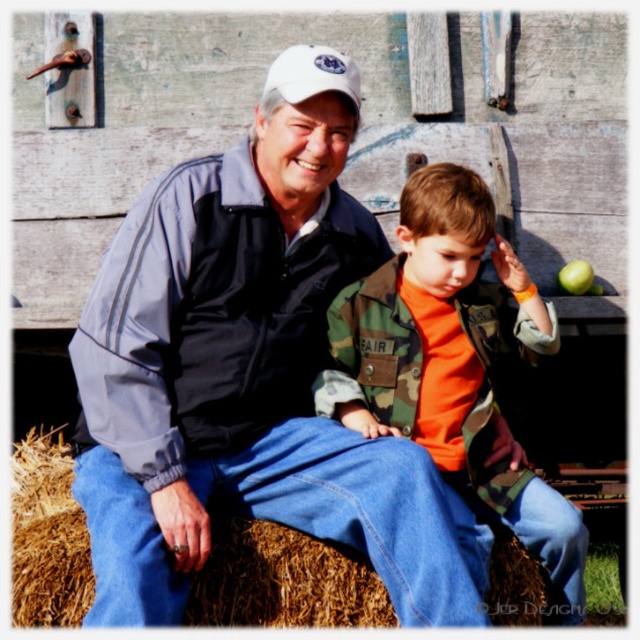
Between point (129, 304) and point (362, 300), which one is positioned in front?

Point (129, 304) is in front.

Does matte blue jacket at center appear on the left side of camouflage jacket at center?

Yes, matte blue jacket at center is to the left of camouflage jacket at center.

Between point (417, 580) and point (429, 260), which one is positioned in front?

Point (417, 580) is in front.

What are the coordinates of `matte blue jacket at center` in the screenshot? It's located at (248, 385).

Does matte blue jacket at center appear on the left side of brown straw bale at center?

In fact, matte blue jacket at center is to the right of brown straw bale at center.

Who is more forward, [179,376] or [22,477]?

Point [179,376] is more forward.

The width and height of the screenshot is (640, 640). What are the coordinates of `matte blue jacket at center` in the screenshot? It's located at click(248, 385).

Measure the distance between matte blue jacket at center and camera.

matte blue jacket at center is 3.94 meters from camera.

Is matte blue jacket at center to the right of green matte apple at upper right from the viewer's perspective?

In fact, matte blue jacket at center is to the left of green matte apple at upper right.

Is point (301, 337) positioned before point (579, 289)?

Yes.

Locate an element on the screen. Image resolution: width=640 pixels, height=640 pixels. matte blue jacket at center is located at coordinates tap(248, 385).